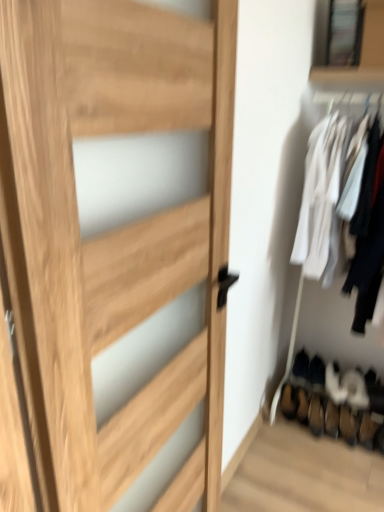
Question: Is black suede shoe at lower right, marked as the 4th shoe in a right-to-left arrangement, beside brown suede shoe at lower right, which ranks as the fifth shoe in right-to-left order?

Choices:
 (A) yes
 (B) no

Answer: (B)

Question: Does black suede shoe at lower right, marked as the 4th shoe in a right-to-left arrangement, turn towards brown suede shoe at lower right, which ranks as the fifth shoe in right-to-left order?

Choices:
 (A) yes
 (B) no

Answer: (A)

Question: Does black suede shoe at lower right, marked as the 4th shoe in a right-to-left arrangement, appear on the left side of brown suede shoe at lower right, which ranks as the fifth shoe in right-to-left order?

Choices:
 (A) no
 (B) yes

Answer: (A)

Question: Are black suede shoe at lower right, which ranks as the 2th shoe in left-to-right order, and brown suede shoe at lower right, which ranks as the fifth shoe in right-to-left order, located far from each other?

Choices:
 (A) yes
 (B) no

Answer: (B)

Question: Is black suede shoe at lower right, which ranks as the 2th shoe in left-to-right order, shorter than brown suede shoe at lower right, the first shoe positioned from the left?

Choices:
 (A) yes
 (B) no

Answer: (A)

Question: Is black suede shoe at lower right, marked as the 4th shoe in a right-to-left arrangement, wider than brown suede shoe at lower right, which ranks as the fifth shoe in right-to-left order?

Choices:
 (A) no
 (B) yes

Answer: (B)

Question: Is natural wood door at center bigger than white suede shoe at lower right, placed as the second shoe when sorted from right to left?

Choices:
 (A) yes
 (B) no

Answer: (A)

Question: From the image's perspective, is natural wood door at center under white suede shoe at lower right, placed as the second shoe when sorted from right to left?

Choices:
 (A) no
 (B) yes

Answer: (A)

Question: Is natural wood door at center thinner than white suede shoe at lower right, placed as the second shoe when sorted from right to left?

Choices:
 (A) yes
 (B) no

Answer: (A)

Question: Does natural wood door at center appear on the right side of white suede shoe at lower right, placed as the fourth shoe when sorted from left to right?

Choices:
 (A) yes
 (B) no

Answer: (B)

Question: Would you say natural wood door at center is outside white suede shoe at lower right, placed as the second shoe when sorted from right to left?

Choices:
 (A) no
 (B) yes

Answer: (B)

Question: Does natural wood door at center appear on the left side of white suede shoe at lower right, placed as the second shoe when sorted from right to left?

Choices:
 (A) no
 (B) yes

Answer: (B)

Question: Is white suede shoe at lower right, placed as the second shoe when sorted from right to left, in contact with black suede shoe at lower right, which ranks as the 2th shoe in left-to-right order?

Choices:
 (A) no
 (B) yes

Answer: (A)